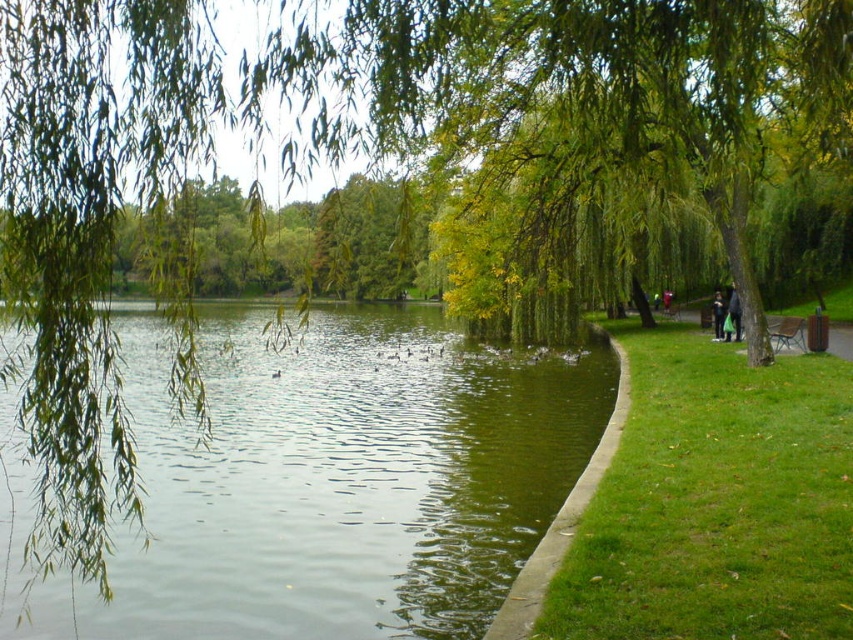
Question: Which object appears closest to the camera in this image?

Choices:
 (A) green concrete path at lower center
 (B) dark blue jeans at right

Answer: (A)

Question: Which object is farther from the camera taking this photo?

Choices:
 (A) green concrete path at lower center
 (B) wooden park bench at right
 (C) dark blue jeans at right
 (D) dark gray fabric jacket at right

Answer: (C)

Question: Is the position of green liquid water at center more distant than that of wooden park bench at right?

Choices:
 (A) yes
 (B) no

Answer: (B)

Question: Observing the image, what is the correct spatial positioning of green liquid water at center in reference to dark gray fabric jacket at right?

Choices:
 (A) left
 (B) right

Answer: (A)

Question: Which of the following is the closest to the observer?

Choices:
 (A) (515, 596)
 (B) (735, 330)
 (C) (787, 340)

Answer: (A)

Question: Does dark blue jeans at right appear on the right side of dark gray fabric jacket at right?

Choices:
 (A) yes
 (B) no

Answer: (A)